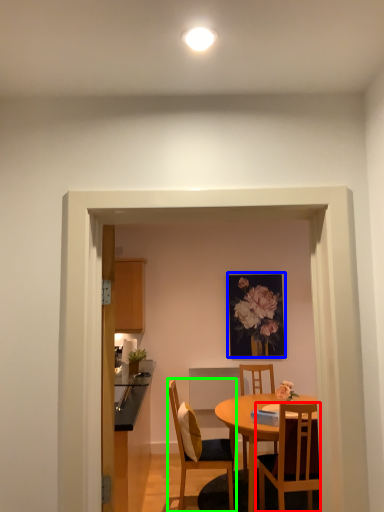
Question: Estimate the real-world distances between objects in this image. Which object is closer to chair (highlighted by a red box), picture frame (highlighted by a blue box) or chair (highlighted by a green box)?

Choices:
 (A) picture frame
 (B) chair

Answer: (B)